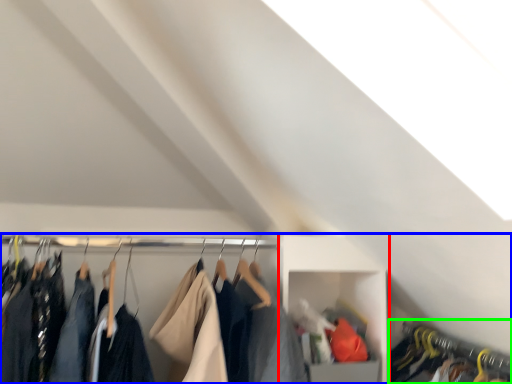
Question: Which object is the farthest from cabinet (highlighted by a red box)? Choose among these: closet (highlighted by a blue box) or closet (highlighted by a green box).

Choices:
 (A) closet
 (B) closet

Answer: (B)